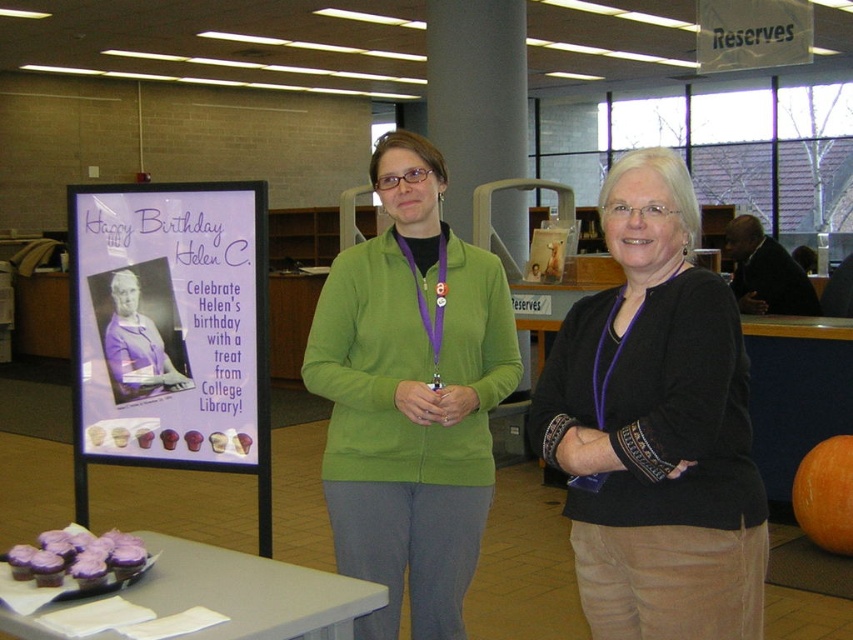
Question: Which object is positioned farthest from the black matte sweater at center?

Choices:
 (A) purple frosted cupcake at lower left
 (B) green fleece jacket at center
 (C) purple fabric at center

Answer: (C)

Question: Among these points, which one is nearest to the camera?

Choices:
 (A) (447, 317)
 (B) (68, 536)
 (C) (120, 376)
 (D) (674, 426)

Answer: (D)

Question: Is purple paper poster at upper left to the left of purple fabric at center from the viewer's perspective?

Choices:
 (A) yes
 (B) no

Answer: (B)

Question: Is purple paper poster at upper left positioned before dark brown leather jacket at upper right?

Choices:
 (A) no
 (B) yes

Answer: (B)

Question: Does green fleece jacket at center appear on the right side of purple fabric at center?

Choices:
 (A) no
 (B) yes

Answer: (B)

Question: Considering the real-world distances, which object is closest to the black matte sweater at center?

Choices:
 (A) green fleece jacket at center
 (B) green fabric sweater at center

Answer: (A)